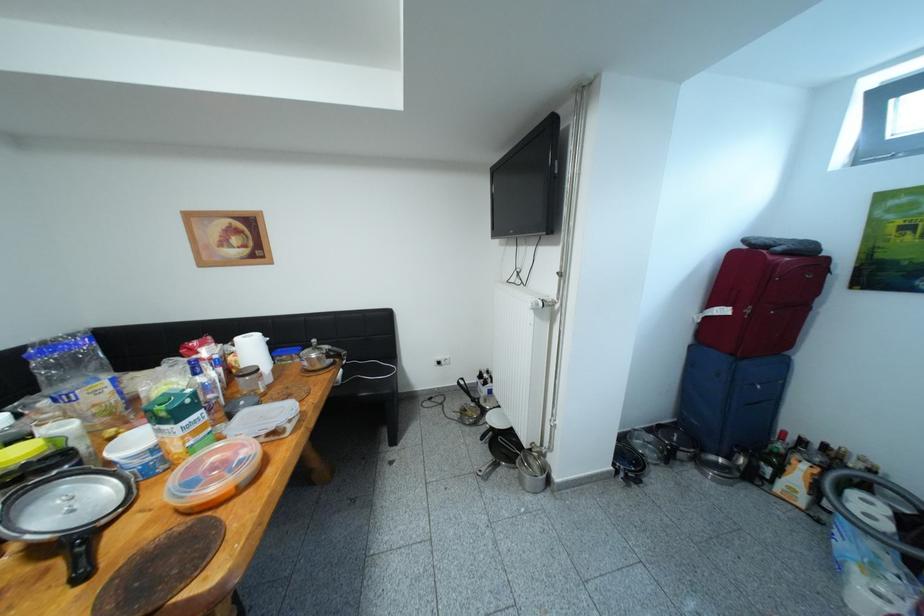
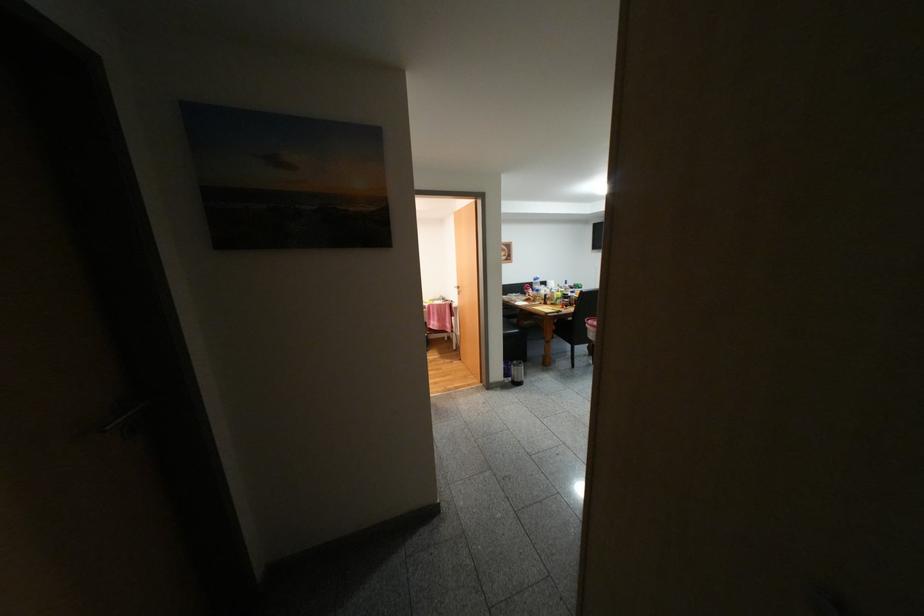
What movement of the cameraman would produce the second image?

The movement direction of the cameraman is left, backward.